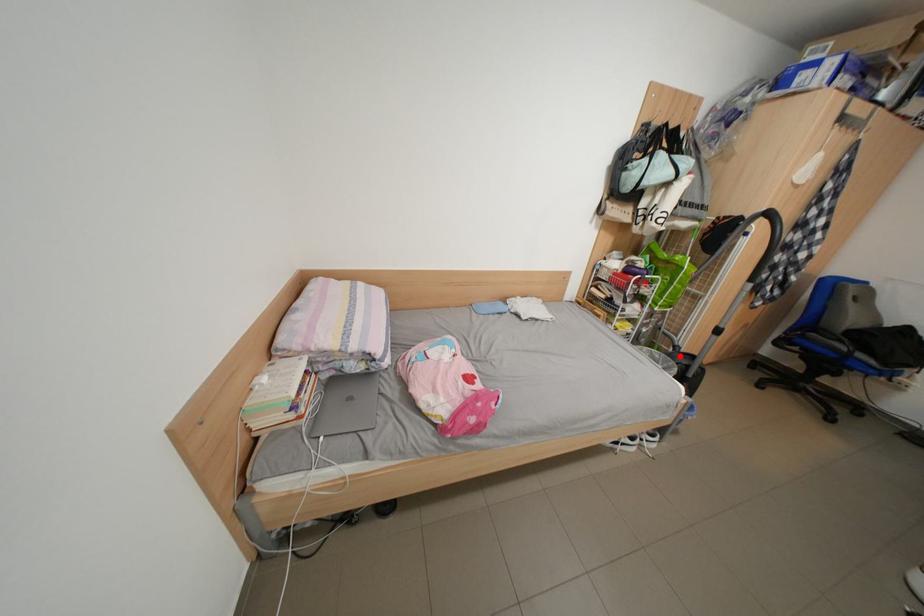
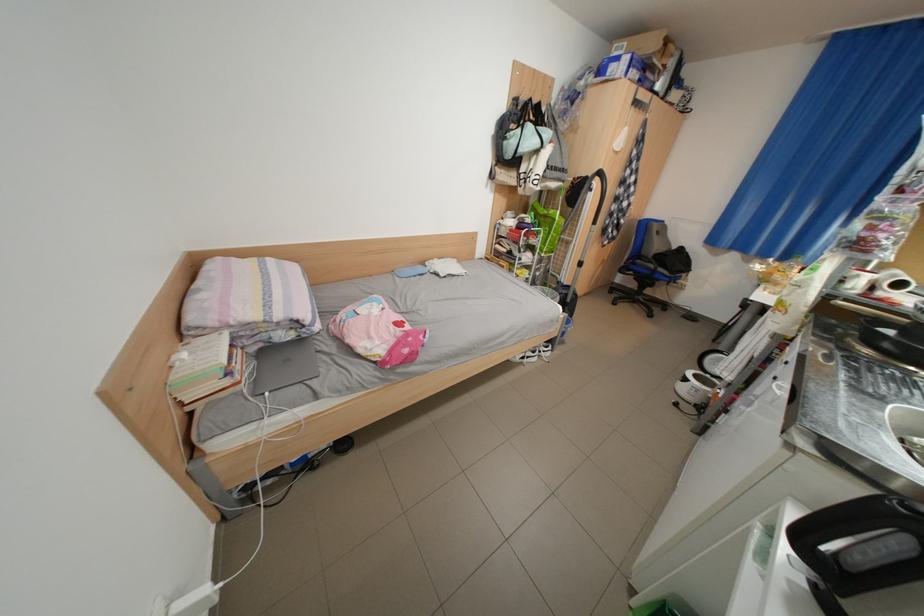
In the second image, find the point that corresponds to the highlighted location in the first image.

(565, 291)